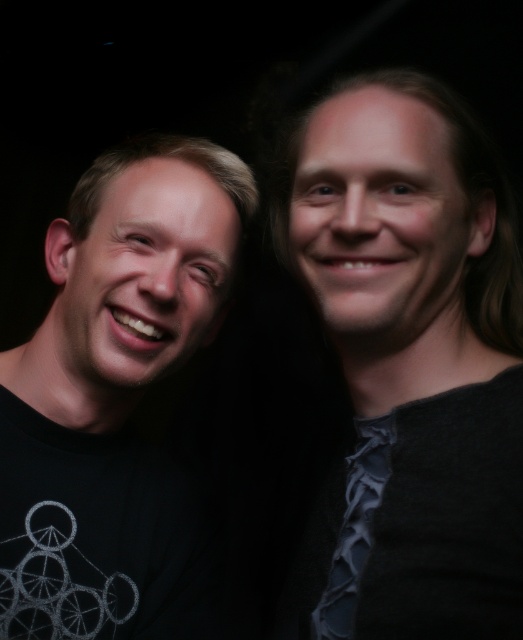
Question: Which point is farther to the camera?

Choices:
 (A) dark blue textured tie at right
 (B) gray wool sweater at upper right

Answer: (A)

Question: Where is gray wool sweater at upper right located in relation to dark blue textured tie at right in the image?

Choices:
 (A) right
 (B) left

Answer: (A)

Question: Which point is closer to the camera?

Choices:
 (A) black matte t-shirt at left
 (B) gray wool sweater at upper right

Answer: (B)

Question: Does gray wool sweater at upper right have a smaller size compared to dark blue textured tie at right?

Choices:
 (A) no
 (B) yes

Answer: (A)

Question: Which point is farther from the camera taking this photo?

Choices:
 (A) (244, 186)
 (B) (385, 416)
 (C) (468, 262)

Answer: (A)

Question: Is gray wool sweater at upper right behind black matte t-shirt at left?

Choices:
 (A) no
 (B) yes

Answer: (A)